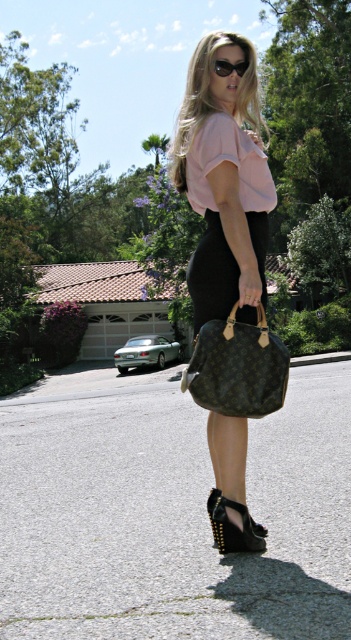
Is matte black dress at center positioned at the back of monogram canvas handbag at center?

Yes, matte black dress at center is further from the viewer.

Between matte black dress at center and monogram canvas handbag at center, which one has less height?

monogram canvas handbag at center

Identify the location of matte black dress at center. (223, 180).

You are a GUI agent. You are given a task and a screenshot of the screen. Output one action in this format:
    pyautogui.click(x=<x>, y=<y>)
    Task: Click on the matte black dress at center
    This screenshot has height=640, width=351.
    Given the screenshot: What is the action you would take?
    pyautogui.click(x=223, y=180)

Is matte black dress at center above black studded leather sandal at lower center?

Yes.

Does matte black dress at center have a greater width compared to black studded leather sandal at lower center?

Yes, matte black dress at center is wider than black studded leather sandal at lower center.

Locate an element on the screen. Image resolution: width=351 pixels, height=640 pixels. matte black dress at center is located at coordinates (223, 180).

From the picture: Is black studded leather sandal at lower center wider than sunglasses at center?

Correct, the width of black studded leather sandal at lower center exceeds that of sunglasses at center.

Can you confirm if black studded leather sandal at lower center is positioned to the left of sunglasses at center?

Yes, black studded leather sandal at lower center is to the left of sunglasses at center.

Who is more distant from viewer, (213,497) or (246,68)?

Point (213,497)

You are a GUI agent. You are given a task and a screenshot of the screen. Output one action in this format:
    pyautogui.click(x=<x>, y=<y>)
    Task: Click on the black studded leather sandal at lower center
    The image size is (351, 640).
    Given the screenshot: What is the action you would take?
    pyautogui.click(x=234, y=525)